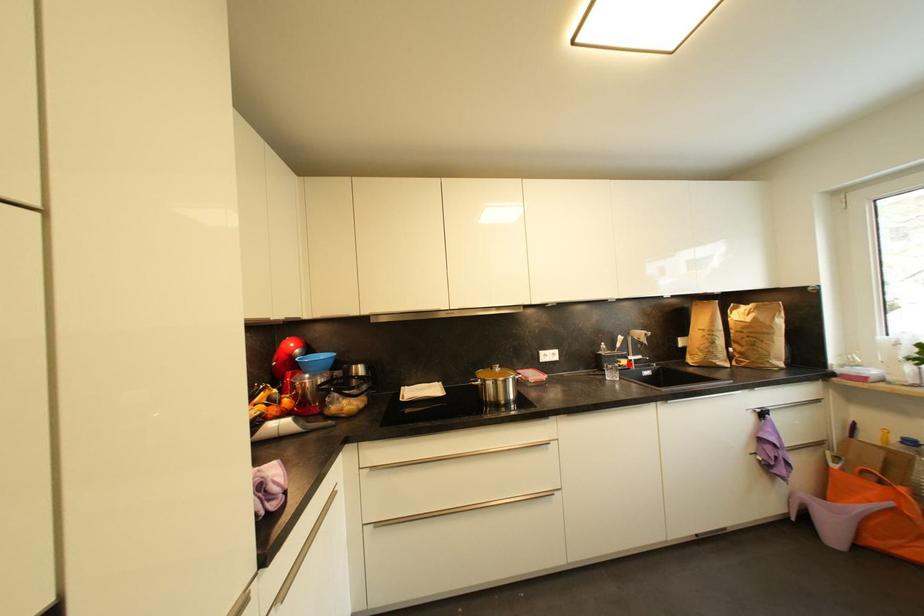
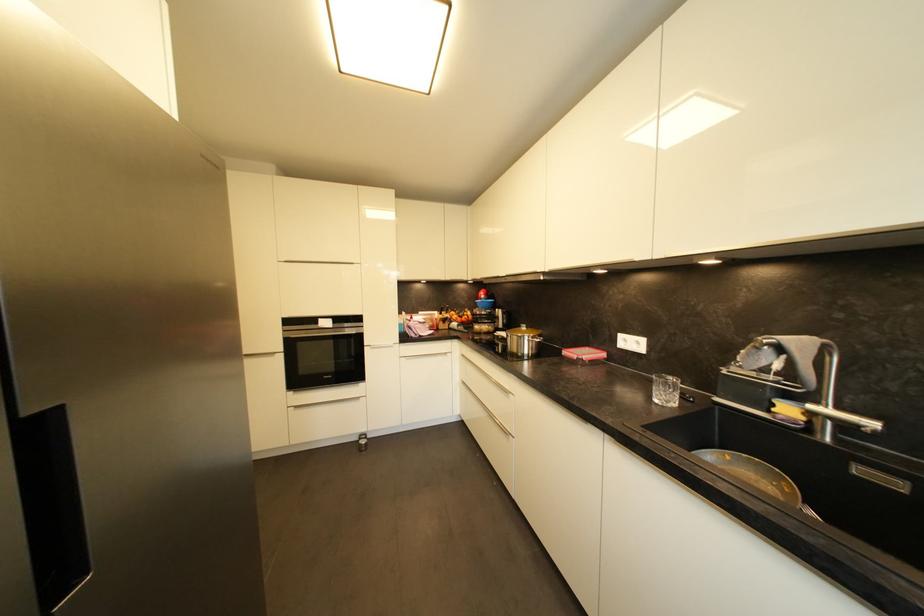
Locate, in the second image, the point that corresponds to the highlighted location in the first image.

(793, 411)